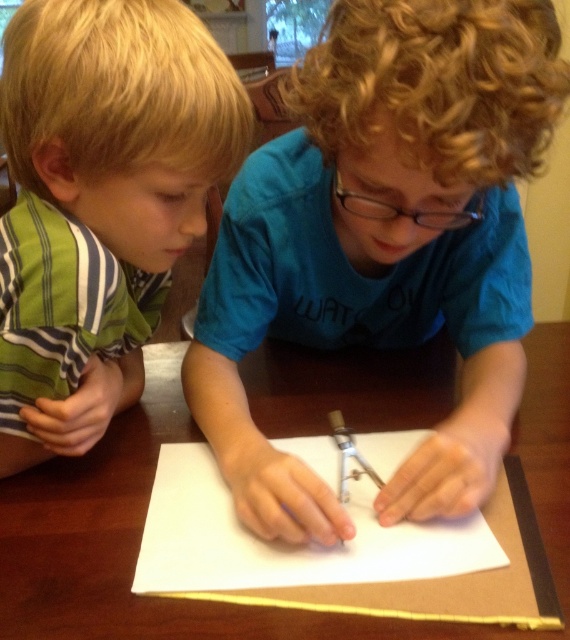
Is white paper at center below metallic silver compass at center?

Yes, white paper at center is below metallic silver compass at center.

Can you confirm if white paper at center is shorter than metallic silver compass at center?

In fact, white paper at center may be taller than metallic silver compass at center.

Does point (235, 577) come behind point (339, 474)?

No, (235, 577) is in front of (339, 474).

Locate an element on the screen. white paper at center is located at coordinates (287, 545).

Who is higher up, blue matte shirt at center or white paper at center?

blue matte shirt at center

How distant is blue matte shirt at center from white paper at center?

They are 6.02 inches apart.

Which is in front, point (331, 307) or point (302, 442)?

Point (302, 442)

What are the coordinates of `blue matte shirt at center` in the screenshot? It's located at (384, 243).

Can you confirm if blue matte shirt at center is positioned to the right of metallic silver compass at center?

Indeed, blue matte shirt at center is positioned on the right side of metallic silver compass at center.

Is point (258, 442) positioned before point (339, 467)?

Yes.

Is point (528, 291) positioned behind point (345, 451)?

Yes, it is behind point (345, 451).

Identify the location of blue matte shirt at center. The height and width of the screenshot is (640, 570). (384, 243).